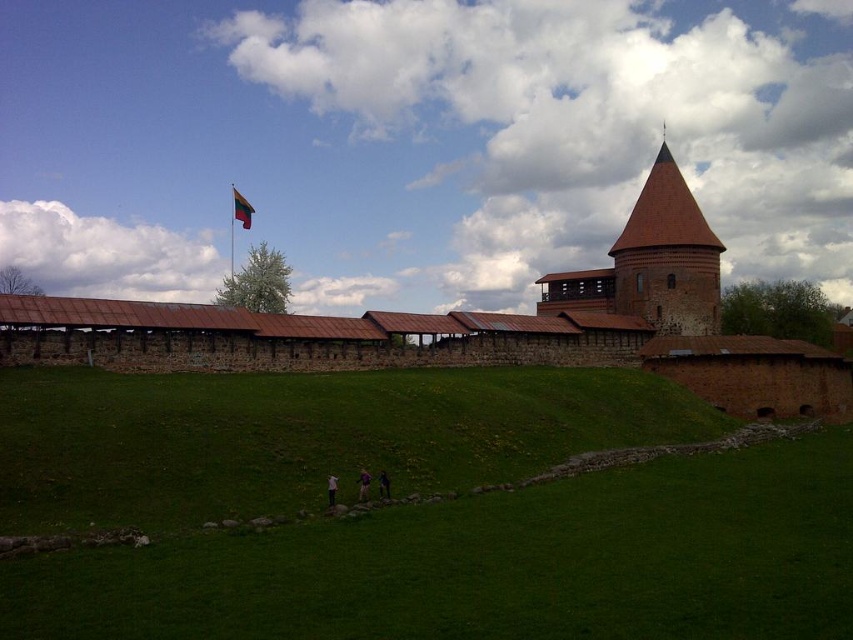
You are standing at the base of the historic stone fortress and want to take a photo of the flagpole with the Lithuanian flag. To ensure both the flagpole and the white fabric shirt at lower center are visible in the frame, where should you position the green grassy hill at lower center?

The green grassy hill at lower center is in front of the white fabric shirt at lower center. To include both the flagpole and the white fabric shirt at lower center in the photo, you should position yourself so that the green grassy hill at lower center is not blocking the view of the white fabric shirt at lower center. This can be achieved by moving slightly to the side or adjusting the angle of your camera so that the hill is either behind or beside the shirt, ensuring both elements are visible.

You are a tourist visiting the fortress and want to take a photo of the brown stone castle at center. To avoid the green felt flag at upper left from blocking the view, where should you position yourself relative to the castle?

The brown stone castle at center is positioned under the green felt flag at upper left, so to avoid the flag blocking the view, you should position yourself to the right side of the castle where the flag is not present.

You are standing in front of the historic stone fortress and want to take a photo that includes both the flagpole and the conical tower. You notice two points marked on the ground at coordinates point (x=672, y=236) and point (x=378, y=486). Which point should you stand closer to ensure both landmarks are in frame?

You should stand closer to point (x=378, y=486) because point (x=672, y=236) is further away from the camera, so positioning yourself near the closer point will help keep both the flagpole and the tower within the camera frame.